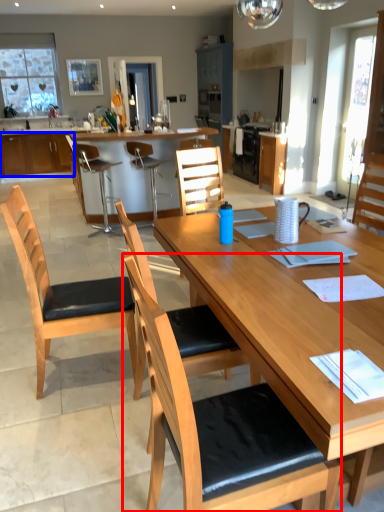
Question: Which object appears closest to the camera in this image, chair (highlighted by a red box) or cabinetry (highlighted by a blue box)?

Choices:
 (A) chair
 (B) cabinetry

Answer: (A)